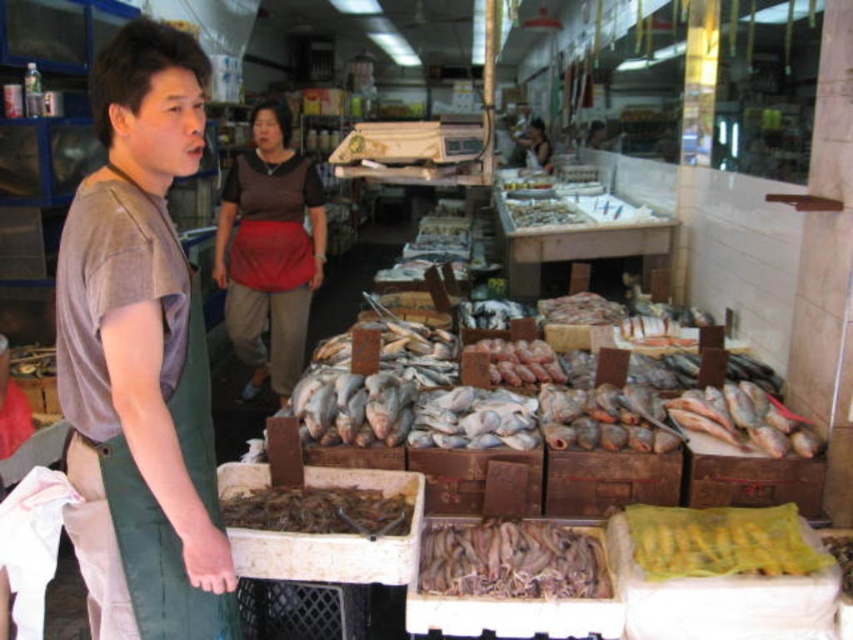
Question: Which object appears closest to the camera in this image?

Choices:
 (A) yellow mesh bag at lower right
 (B) brown fabric apron at center
 (C) brownish matte fish at center
 (D) brown dried fish at center

Answer: (A)

Question: Can you confirm if brownish matte fish at center is positioned above yellow mesh bag at lower right?

Choices:
 (A) no
 (B) yes

Answer: (A)

Question: Which object is farther from the camera taking this photo?

Choices:
 (A) matte gray shirt at center
 (B) brown matte fish at center
 (C) matte brown apron at center
 (D) brownish matte fish at center

Answer: (C)

Question: Is brownish matte fish at center behind brown dried fish at center?

Choices:
 (A) yes
 (B) no

Answer: (A)

Question: Does brownish matte fish at center have a larger size compared to brown dried fish at center?

Choices:
 (A) no
 (B) yes

Answer: (B)

Question: Which of these objects is positioned farthest from the brownish matte fish at center?

Choices:
 (A) brown matte fish at center
 (B) matte brown apron at center
 (C) brown dried fish at center

Answer: (B)